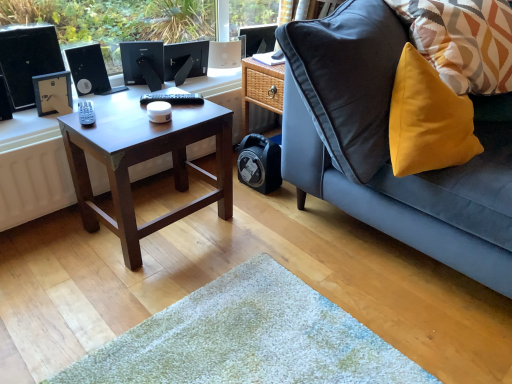
The image size is (512, 384). I want to click on vacant region under dark brown wood coffee table at center (from a real-world perspective), so click(169, 223).